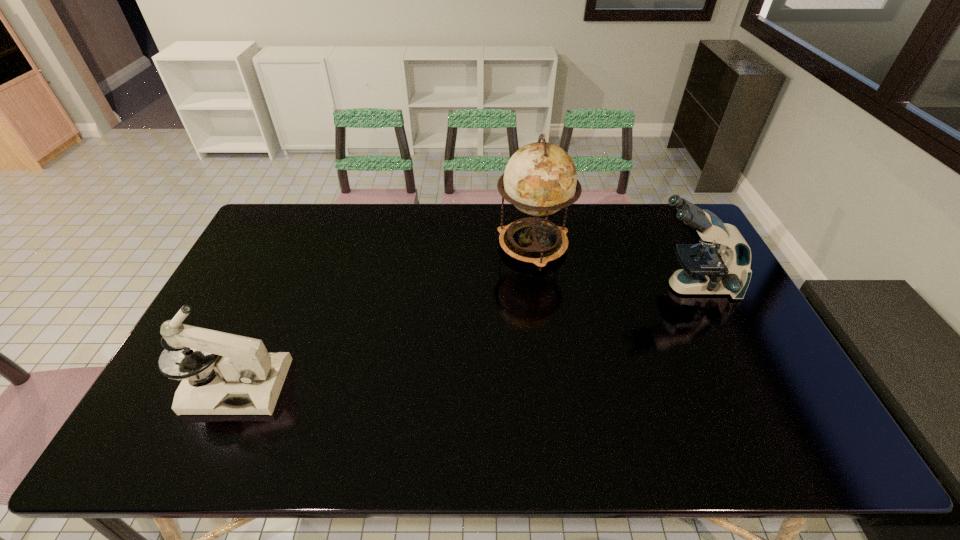
Find the location of a particular element. The width and height of the screenshot is (960, 540). free space located 0.350m at the eyepiece of the left microscope is located at coordinates (420, 386).

Find the location of a particular element. object located in the far edge section of the desktop is located at coordinates (540, 178).

I want to click on object situated at the left edge, so click(248, 381).

Locate an element on the screen. object that is at the right edge is located at coordinates (706, 269).

Where is `free space at the far edge`? This screenshot has width=960, height=540. free space at the far edge is located at coordinates (380, 211).

You are a GUI agent. You are given a task and a screenshot of the screen. Output one action in this format:
    pyautogui.click(x=<x>, y=<y>)
    Task: Click on the free location at the near edge
    The image size is (960, 540).
    Given the screenshot: What is the action you would take?
    pyautogui.click(x=326, y=444)

In the image, there is a desktop. Where is `free region at the left edge`? This screenshot has height=540, width=960. free region at the left edge is located at coordinates point(248,293).

You are a GUI agent. You are given a task and a screenshot of the screen. Output one action in this format:
    pyautogui.click(x=<x>, y=<y>)
    Task: Click on the free space at the right edge
    
    Given the screenshot: What is the action you would take?
    pyautogui.click(x=729, y=308)

Locate an element on the screen. vacant space at the far left corner of the desktop is located at coordinates (274, 217).

This screenshot has width=960, height=540. Find the location of `vacant space at the far right corner of the desktop`. vacant space at the far right corner of the desktop is located at coordinates (684, 224).